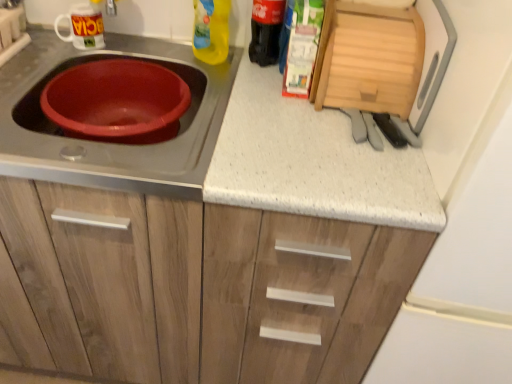
Where is `free spot to the right of white glossy mug at upper left, the second appliance in the right-to-left sequence`? The width and height of the screenshot is (512, 384). free spot to the right of white glossy mug at upper left, the second appliance in the right-to-left sequence is located at coordinates (136, 57).